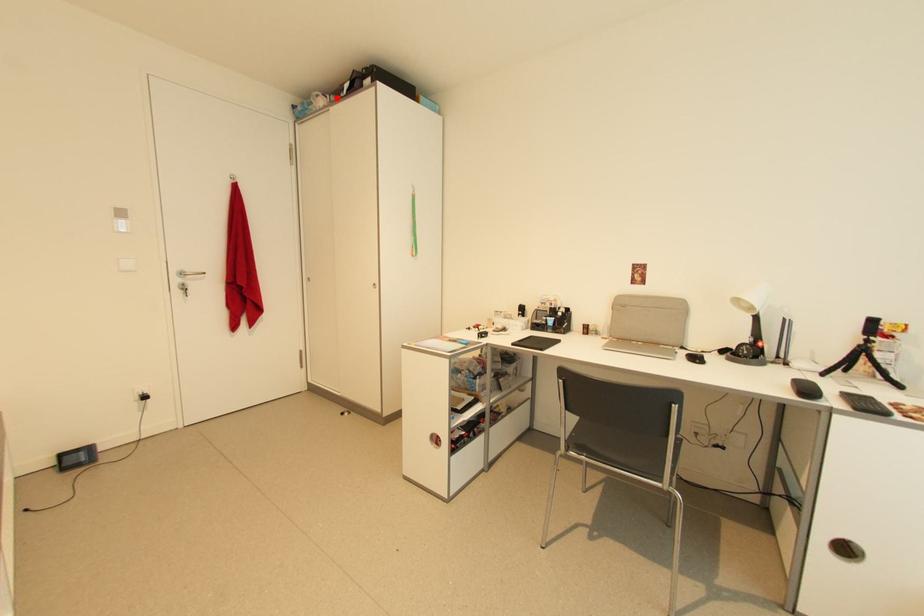
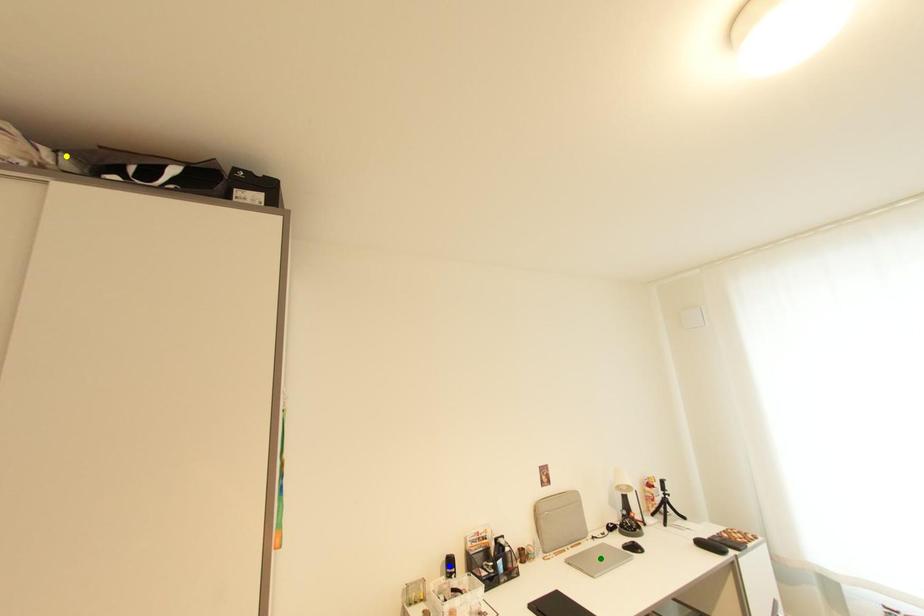
Question: I am providing you with two images of the same scene from different viewpoints. A red point is marked on the first image. You are given multiple points on the second image. Which mark in image 2 goes with the point in image 1?

Choices:
 (A) yellow point
 (B) green point
 (C) blue point

Answer: (A)